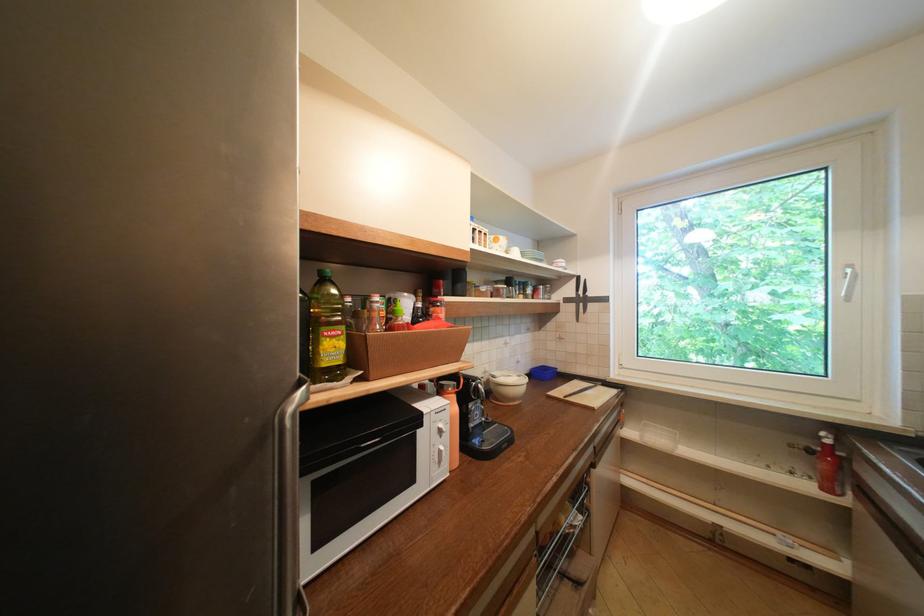
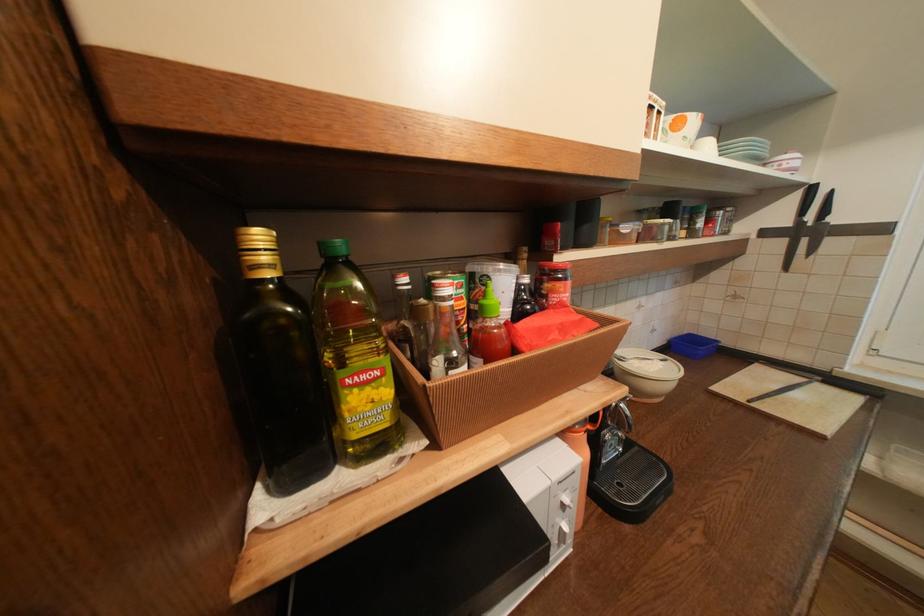
The point at (527, 379) is marked in the first image. Where is the corresponding point in the second image?

(670, 363)